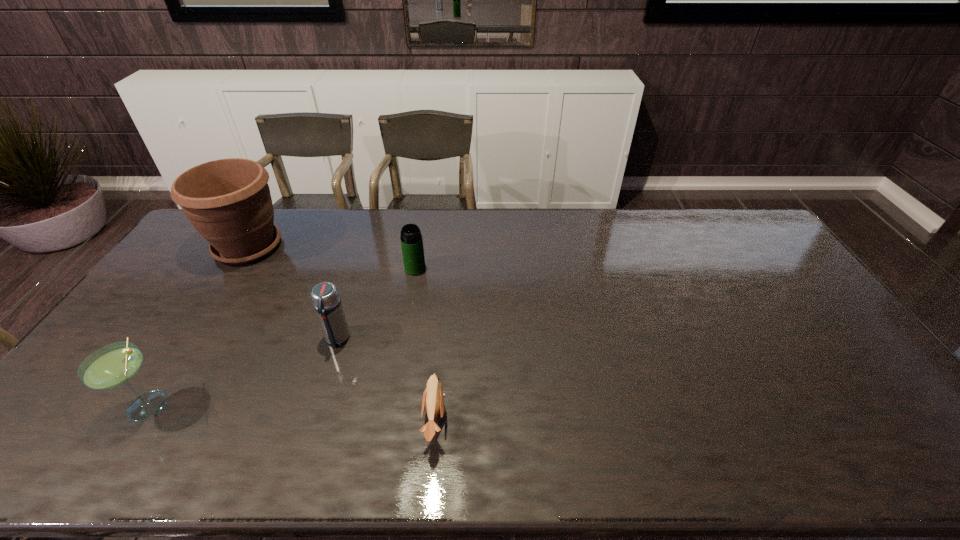
Identify the location of free space between the third object from left to right and the shortest object. 386,379.

Locate an element on the screen. The width and height of the screenshot is (960, 540). vacant area between the fourth object from left to right and the nearer thermos bottle is located at coordinates (376, 303).

The height and width of the screenshot is (540, 960). Identify the location of object that is the third closest to the left thermos bottle. (115, 364).

Identify which object is the third nearest to the farther thermos bottle. Please provide its 2D coordinates. Your answer should be formatted as a tuple, i.e. [(x, y)], where the tuple contains the x and y coordinates of a point satisfying the conditions above.

[(433, 398)]